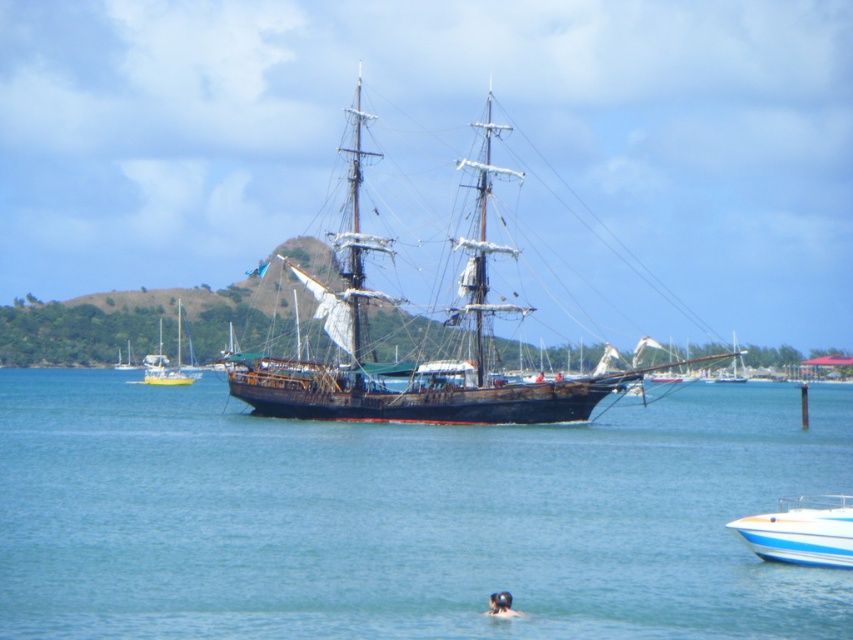
You are a photographer planning to take a picture of the blue water at center. According to the coordinates provided, where exactly should you aim your camera?

The blue water at center is located at coordinates point [405,516].

You are a photographer trying to capture the blurred skin head at lower center and the blue glossy speedboat at lower right in the same frame. Based on their positions, which object should appear closer to the camera in your photo?

The blue glossy speedboat at lower right appears closer to the camera because the blurred skin head at lower center is positioned behind it.